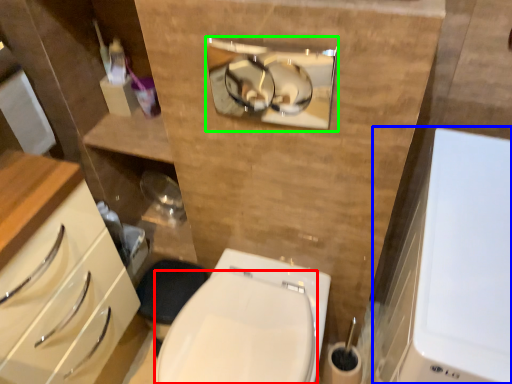
Question: Which object is the closest to the bidet (highlighted by a red box)? Choose among these: medicine cabinet (highlighted by a blue box) or medicine cabinet (highlighted by a green box).

Choices:
 (A) medicine cabinet
 (B) medicine cabinet

Answer: (A)